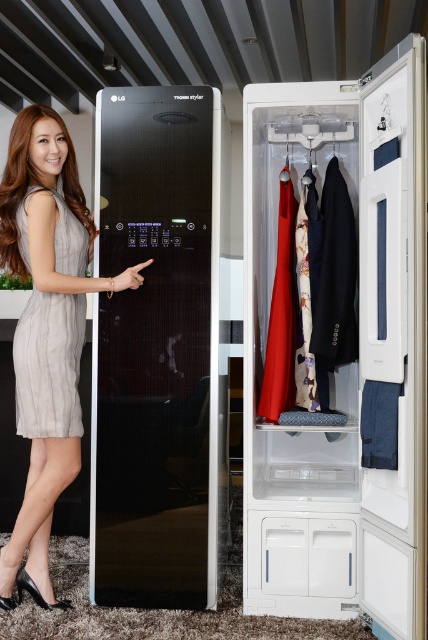
Can you confirm if satin beige dress at left is taller than light gray sheer dress at left?

Correct, satin beige dress at left is much taller as light gray sheer dress at left.

Does satin beige dress at left have a lesser width compared to light gray sheer dress at left?

In fact, satin beige dress at left might be wider than light gray sheer dress at left.

Is point (91, 241) in front of point (23, 324)?

No.

The image size is (428, 640). In order to click on satin beige dress at left in this screenshot , I will do `click(47, 328)`.

Is light gray sheer dress at left closer to camera compared to matte plastic hanger at center?

That is True.

Can you confirm if light gray sheer dress at left is positioned to the left of matte plastic hanger at center?

Yes, light gray sheer dress at left is to the left of matte plastic hanger at center.

This screenshot has width=428, height=640. In order to click on light gray sheer dress at left in this screenshot , I will do `click(48, 364)`.

Who is more forward, [38,412] or [294,253]?

Point [38,412] is more forward.

Between satin beige dress at left and silky red dress at center, which one is positioned higher?

silky red dress at center is above.

Which is behind, point (70, 474) or point (270, 400)?

Positioned behind is point (270, 400).

I want to click on satin beige dress at left, so click(47, 328).